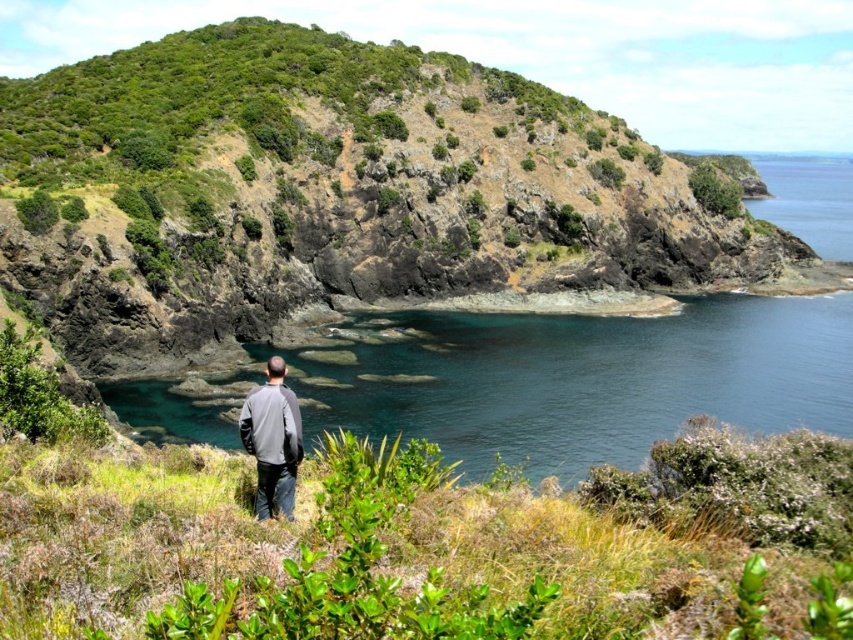
Which is behind, point (254, 410) or point (735, 182)?

Point (735, 182)

Measure the distance from gray fleece jacket at center to green leafy shrub at upper center.

70.01 meters

Does point (293, 474) come in front of point (724, 205)?

Yes, point (293, 474) is in front of point (724, 205).

The height and width of the screenshot is (640, 853). I want to click on gray fleece jacket at center, so click(x=271, y=440).

The height and width of the screenshot is (640, 853). I want to click on clear blue water at center, so click(573, 378).

Between point (813, 342) and point (274, 458), which one is positioned behind?

Positioned behind is point (813, 342).

This screenshot has width=853, height=640. In order to click on clear blue water at center in this screenshot , I will do [x=573, y=378].

Is clear blue water at center smaller than green leafy shrub at upper center?

Incorrect, clear blue water at center is not smaller in size than green leafy shrub at upper center.

Who is higher up, clear blue water at center or green leafy shrub at upper center?

green leafy shrub at upper center is above.

Measure the distance between point (503, 372) and camera.

A distance of 48.51 meters exists between point (503, 372) and camera.

Locate an element on the screen. The image size is (853, 640). clear blue water at center is located at coordinates (573, 378).